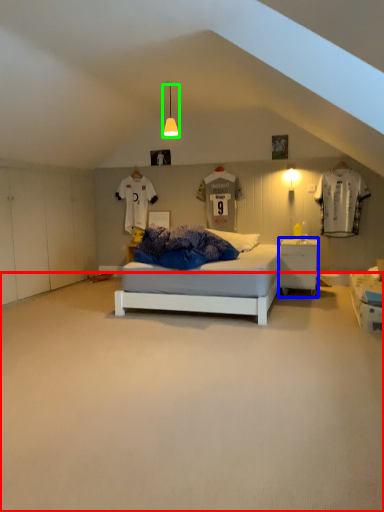
Question: Which is farther away from plain (highlighted by a red box)? nightstand (highlighted by a blue box) or light fixture (highlighted by a green box)?

Choices:
 (A) nightstand
 (B) light fixture

Answer: (B)